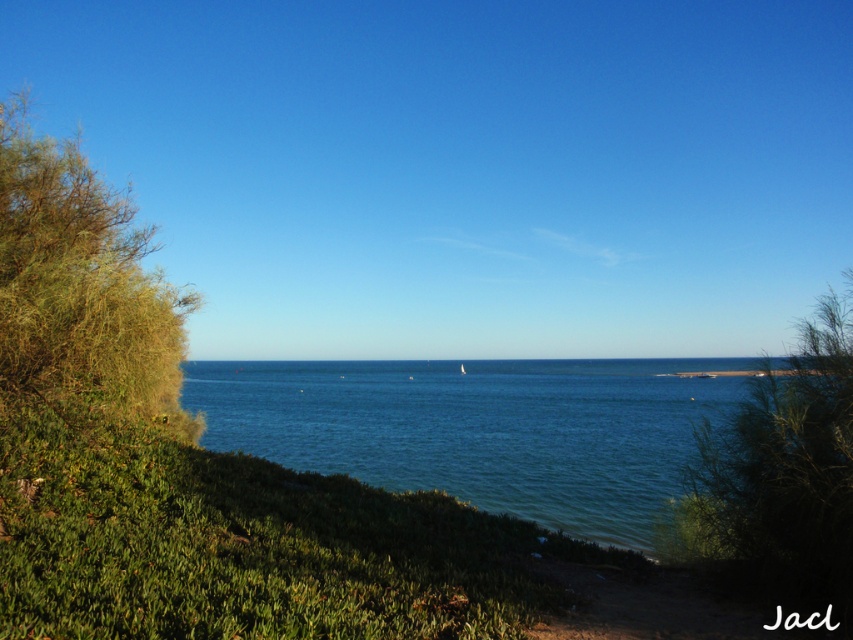
Question: Based on their relative distances, which object is farther from the green leafy shrub at left?

Choices:
 (A) blue water at center
 (B) green leafy shrub at center-right

Answer: (A)

Question: Estimate the real-world distances between objects in this image. Which object is farther from the green leafy shrub at left?

Choices:
 (A) blue water at center
 (B) green leafy shrub at center-right

Answer: (A)

Question: Based on their relative distances, which object is nearer to the green leafy shrub at center-right?

Choices:
 (A) green leafy shrub at left
 (B) blue water at center

Answer: (A)

Question: Can you confirm if blue water at center is thinner than green leafy shrub at left?

Choices:
 (A) no
 (B) yes

Answer: (A)

Question: From the image, what is the correct spatial relationship of green leafy shrub at left in relation to green leafy shrub at center-right?

Choices:
 (A) above
 (B) below

Answer: (B)

Question: Is blue water at center above green leafy shrub at center-right?

Choices:
 (A) yes
 (B) no

Answer: (B)